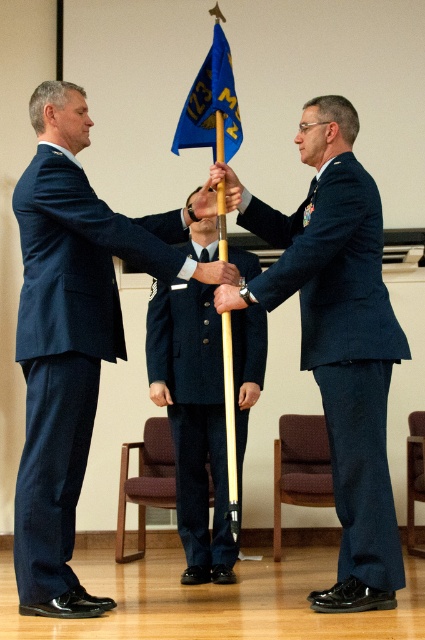
Which is behind, point (33, 212) or point (365, 362)?

The point (33, 212) is behind.

Consider the image. Can you confirm if navy wool suit at left is thinner than navy blue fabric uniform at center?

No, navy wool suit at left is not thinner than navy blue fabric uniform at center.

Does point (39, 396) lie behind point (373, 492)?

Yes, it is behind point (373, 492).

At what (x,y) coordinates should I click in order to perform the action: click on navy wool suit at left. Please return your answer as a coordinate pair (x, y). This screenshot has height=640, width=425. Looking at the image, I should click on (68, 348).

Is point (125, 244) closer to camera compared to point (221, 61)?

Yes, it is.

Is navy wool suit at left behind blue fabric flag at upper center?

No.

Is point (71, 212) positioned in front of point (197, 108)?

Yes, it is.

Identify the location of navy wool suit at left. This screenshot has width=425, height=640. (68, 348).

Between navy blue fabric uniform at center and navy blue uniform at center, which one has more height?

navy blue fabric uniform at center

Identify the location of navy blue fabric uniform at center. (342, 348).

Where is `navy blue fabric uniform at center`? navy blue fabric uniform at center is located at coordinates (342, 348).

Identify the location of navy blue fabric uniform at center. Image resolution: width=425 pixels, height=640 pixels. 342,348.